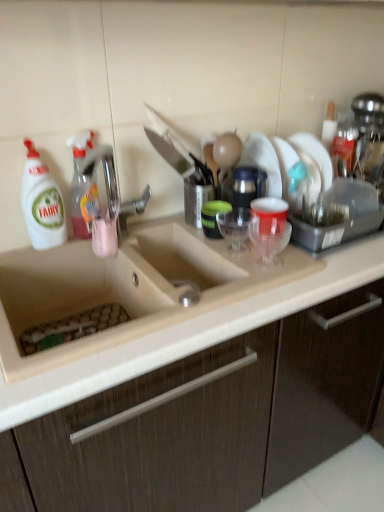
What are the coordinates of `white plastic bottle at left, marked as the 2th cleaning product in a right-to-left arrangement` in the screenshot? It's located at (42, 203).

Locate an element on the screen. The image size is (384, 512). beige ceramic sink at center is located at coordinates (124, 288).

The height and width of the screenshot is (512, 384). Describe the element at coordinates (269, 238) in the screenshot. I see `transparent plastic cup at center, which is the second tableware in left-to-right order` at that location.

This screenshot has width=384, height=512. Describe the element at coordinates (213, 217) in the screenshot. I see `translucent plastic cup at sink, which is counted as the 1th tableware, starting from the back` at that location.

In order to face translucent plastic cup at sink, positioned as the first tableware in left-to-right order, should I rotate leftwards or rightwards?

Turn right approximately 3.531 degrees to face it.

Locate an element on the screen. The width and height of the screenshot is (384, 512). white plastic bottle at left, marked as the 2th cleaning product in a right-to-left arrangement is located at coordinates (42, 203).

Would you say translucent plastic spray bottle at left, which appears as the 2th cleaning product when viewed from the left, is a long distance from transparent plastic cup at center, placed as the first tableware when sorted from right to left?

translucent plastic spray bottle at left, which appears as the 2th cleaning product when viewed from the left, is actually quite close to transparent plastic cup at center, placed as the first tableware when sorted from right to left.

How far apart are translucent plastic spray bottle at left, which appears as the 2th cleaning product when viewed from the left, and transparent plastic cup at center, placed as the first tableware when sorted from right to left?

translucent plastic spray bottle at left, which appears as the 2th cleaning product when viewed from the left, is 18.79 inches away from transparent plastic cup at center, placed as the first tableware when sorted from right to left.

Could you tell me if translucent plastic spray bottle at left, which appears as the 2th cleaning product when viewed from the left, is facing transparent plastic cup at center, acting as the 2th tableware starting from the back?

Yes, translucent plastic spray bottle at left, which appears as the 2th cleaning product when viewed from the left, is facing transparent plastic cup at center, acting as the 2th tableware starting from the back.

Which object is closer to the camera, translucent plastic spray bottle at left, positioned as the first cleaning product in right-to-left order, or transparent plastic cup at center, marked as the 1th tableware in a front-to-back arrangement?

transparent plastic cup at center, marked as the 1th tableware in a front-to-back arrangement, is in front.

Between transparent plastic cup at center, marked as the 1th tableware in a front-to-back arrangement, and beige ceramic sink at center, which one appears on the right side from the viewer's perspective?

From the viewer's perspective, transparent plastic cup at center, marked as the 1th tableware in a front-to-back arrangement, appears more on the right side.

Does transparent plastic cup at center, acting as the 2th tableware starting from the back, turn towards beige ceramic sink at center?

No, transparent plastic cup at center, acting as the 2th tableware starting from the back, is not aimed at beige ceramic sink at center.

Can you confirm if transparent plastic cup at center, which is the second tableware in left-to-right order, is bigger than beige ceramic sink at center?

No, transparent plastic cup at center, which is the second tableware in left-to-right order, is not bigger than beige ceramic sink at center.

Does transparent plastic cup at center, which is the second tableware in left-to-right order, have a greater height compared to beige ceramic sink at center?

No.

Is white plastic bottle at left, marked as the 2th cleaning product in a right-to-left arrangement, positioned with its back to matte wood cabinet at center?

That's not correct — white plastic bottle at left, marked as the 2th cleaning product in a right-to-left arrangement, is not looking away from matte wood cabinet at center.

Is white plastic bottle at left, which is counted as the first cleaning product, starting from the left, far away from matte wood cabinet at center?

No, white plastic bottle at left, which is counted as the first cleaning product, starting from the left, is not far away from matte wood cabinet at center.

From a real-world perspective, relative to matte wood cabinet at center, is white plastic bottle at left, which is counted as the first cleaning product, starting from the left, vertically above or below?

Clearly, from a real-world perspective, white plastic bottle at left, which is counted as the first cleaning product, starting from the left, is above matte wood cabinet at center.

Find the location of a particular element. The width and height of the screenshot is (384, 512). cabinetry below the white plastic bottle at left, marked as the 2th cleaning product in a right-to-left arrangement (from a real-world perspective) is located at coordinates (210, 420).

Is point (229, 205) positioned behind point (81, 183)?

Yes, point (229, 205) is behind point (81, 183).

Is translucent plastic spray bottle at left, which appears as the 2th cleaning product when viewed from the left, completely or partially inside translucent plastic cup at sink, positioned as the 2th tableware in right-to-left order?

No.

Could you tell me if translucent plastic cup at sink, acting as the second tableware starting from the front, is facing translucent plastic spray bottle at left, which appears as the 2th cleaning product when viewed from the left?

No, translucent plastic cup at sink, acting as the second tableware starting from the front, is not facing towards translucent plastic spray bottle at left, which appears as the 2th cleaning product when viewed from the left.

Which of these two, translucent plastic cup at sink, positioned as the first tableware in left-to-right order, or translucent plastic spray bottle at left, which appears as the 2th cleaning product when viewed from the left, is smaller?

Smaller between the two is translucent plastic cup at sink, positioned as the first tableware in left-to-right order.

Is matte wood cabinet at center beside transparent plastic cup at center, which is the second tableware in left-to-right order?

No, matte wood cabinet at center is not with transparent plastic cup at center, which is the second tableware in left-to-right order.

Is matte wood cabinet at center in front of or behind transparent plastic cup at center, marked as the 1th tableware in a front-to-back arrangement, in the image?

matte wood cabinet at center is positioned closer to the viewer than transparent plastic cup at center, marked as the 1th tableware in a front-to-back arrangement.

Image resolution: width=384 pixels, height=512 pixels. Identify the location of tableware that is the 1st object to the left of the matte wood cabinet at center, starting at the anchor. (269, 238).

Is matte wood cabinet at center located outside transparent plastic cup at center, which is the second tableware in left-to-right order?

Indeed, matte wood cabinet at center is completely outside transparent plastic cup at center, which is the second tableware in left-to-right order.

From the image's perspective, between translucent plastic spray bottle at left, positioned as the first cleaning product in right-to-left order, and white plastic bottle at left, which is counted as the first cleaning product, starting from the left, which one is located above?

translucent plastic spray bottle at left, positioned as the first cleaning product in right-to-left order.

Where is `cleaning product behind the white plastic bottle at left, which is counted as the first cleaning product, starting from the left`? cleaning product behind the white plastic bottle at left, which is counted as the first cleaning product, starting from the left is located at coordinates (82, 188).

Is the surface of translucent plastic spray bottle at left, which appears as the 2th cleaning product when viewed from the left, in direct contact with white plastic bottle at left, which is counted as the first cleaning product, starting from the left?

Yes, translucent plastic spray bottle at left, which appears as the 2th cleaning product when viewed from the left, is with white plastic bottle at left, which is counted as the first cleaning product, starting from the left.

Considering the points (74, 211) and (30, 227), which point is in front, point (74, 211) or point (30, 227)?

The point (30, 227) is in front.

Is translucent plastic spray bottle at left, which appears as the 2th cleaning product when viewed from the left, inside the boundaries of beige ceramic sink at center, or outside?

translucent plastic spray bottle at left, which appears as the 2th cleaning product when viewed from the left, is spatially situated outside beige ceramic sink at center.

Is translucent plastic spray bottle at left, positioned as the first cleaning product in right-to-left order, shorter than beige ceramic sink at center?

In fact, translucent plastic spray bottle at left, positioned as the first cleaning product in right-to-left order, may be taller than beige ceramic sink at center.

From the picture: Considering the sizes of translucent plastic spray bottle at left, which appears as the 2th cleaning product when viewed from the left, and beige ceramic sink at center in the image, is translucent plastic spray bottle at left, which appears as the 2th cleaning product when viewed from the left, wider or thinner than beige ceramic sink at center?

In the image, translucent plastic spray bottle at left, which appears as the 2th cleaning product when viewed from the left, appears to be more narrow than beige ceramic sink at center.

From a real-world perspective, which tableware is the 1st one underneath the translucent plastic spray bottle at left, positioned as the first cleaning product in right-to-left order? Please provide its 2D coordinates.

[(269, 238)]

Locate an element on the screen. sink below the transparent plastic cup at center, marked as the 1th tableware in a front-to-back arrangement (from the image's perspective) is located at coordinates (124, 288).

When comparing their distances from white plastic bottle at left, marked as the 2th cleaning product in a right-to-left arrangement, does translucent plastic spray bottle at left, positioned as the first cleaning product in right-to-left order, or matte wood cabinet at center seem closer?

Among the two, translucent plastic spray bottle at left, positioned as the first cleaning product in right-to-left order, is located nearer to white plastic bottle at left, marked as the 2th cleaning product in a right-to-left arrangement.

Which object lies nearer to the anchor point translucent plastic spray bottle at left, positioned as the first cleaning product in right-to-left order, translucent plastic cup at sink, positioned as the 2th tableware in right-to-left order, or beige ceramic sink at center?

beige ceramic sink at center lies closer to translucent plastic spray bottle at left, positioned as the first cleaning product in right-to-left order, than the other object.

Based on their spatial positions, is beige ceramic sink at center or transparent plastic cup at center, which is the second tableware in left-to-right order, closer to white plastic bottle at left, which is counted as the first cleaning product, starting from the left?

beige ceramic sink at center lies closer to white plastic bottle at left, which is counted as the first cleaning product, starting from the left, than the other object.

Considering their positions, is transparent plastic cup at center, marked as the 1th tableware in a front-to-back arrangement, positioned closer to translucent plastic spray bottle at left, which appears as the 2th cleaning product when viewed from the left, than matte wood cabinet at center?

transparent plastic cup at center, marked as the 1th tableware in a front-to-back arrangement.

Based on their spatial positions, is white plastic bottle at left, which is counted as the first cleaning product, starting from the left, or translucent plastic spray bottle at left, which appears as the 2th cleaning product when viewed from the left, closer to matte wood cabinet at center?

The object closer to matte wood cabinet at center is translucent plastic spray bottle at left, which appears as the 2th cleaning product when viewed from the left.

When comparing their distances from beige ceramic sink at center, does translucent plastic spray bottle at left, positioned as the first cleaning product in right-to-left order, or translucent plastic cup at sink, which is counted as the 1th tableware, starting from the back, seem further?

Result: Among the two, translucent plastic cup at sink, which is counted as the 1th tableware, starting from the back, is located further to beige ceramic sink at center.

Based on their spatial positions, is transparent plastic cup at center, marked as the 1th tableware in a front-to-back arrangement, or translucent plastic spray bottle at left, positioned as the first cleaning product in right-to-left order, further from beige ceramic sink at center?

Based on the image, transparent plastic cup at center, marked as the 1th tableware in a front-to-back arrangement, appears to be further to beige ceramic sink at center.

From the image, which object appears to be farther from white plastic bottle at left, marked as the 2th cleaning product in a right-to-left arrangement, matte wood cabinet at center or transparent plastic cup at center, placed as the first tableware when sorted from right to left?

matte wood cabinet at center lies further to white plastic bottle at left, marked as the 2th cleaning product in a right-to-left arrangement, than the other object.

Image resolution: width=384 pixels, height=512 pixels. Find the location of `cleaning product located between white plastic bottle at left, which is counted as the first cleaning product, starting from the left, and matte wood cabinet at center in the left-right direction`. cleaning product located between white plastic bottle at left, which is counted as the first cleaning product, starting from the left, and matte wood cabinet at center in the left-right direction is located at coordinates (82, 188).

Find the location of a particular element. This screenshot has height=512, width=384. sink between matte wood cabinet at center and transparent plastic cup at center, acting as the 2th tableware starting from the back, along the z-axis is located at coordinates (124, 288).

Where is `cleaning product located between white plastic bottle at left, marked as the 2th cleaning product in a right-to-left arrangement, and translucent plastic cup at sink, acting as the second tableware starting from the front, in the left-right direction`? The width and height of the screenshot is (384, 512). cleaning product located between white plastic bottle at left, marked as the 2th cleaning product in a right-to-left arrangement, and translucent plastic cup at sink, acting as the second tableware starting from the front, in the left-right direction is located at coordinates (82, 188).

Locate an element on the screen. sink situated between white plastic bottle at left, which is counted as the first cleaning product, starting from the left, and transparent plastic cup at center, which is the second tableware in left-to-right order, from left to right is located at coordinates (124, 288).